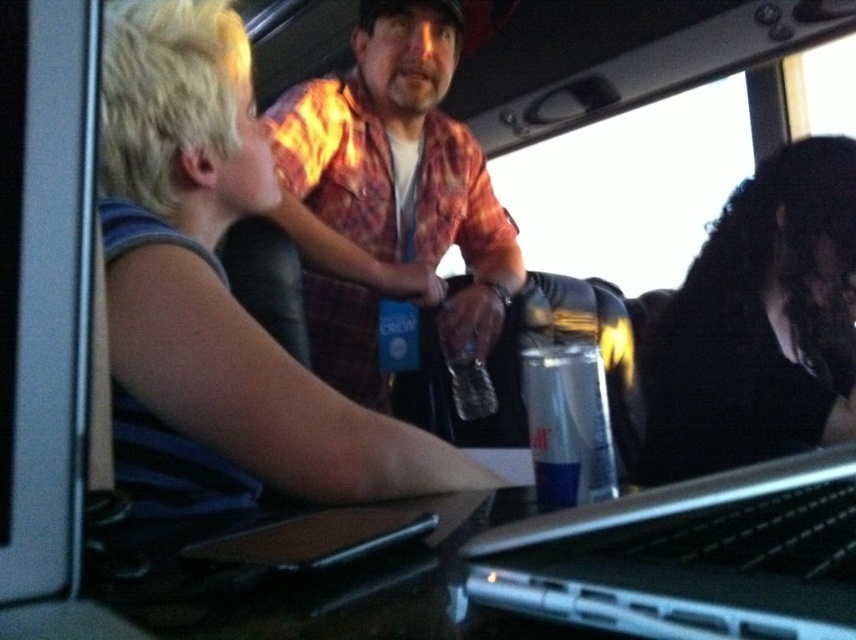
Who is higher up, blonde hair at upper left or clear plastic can at center?

blonde hair at upper left

Does point (280, 432) lie in front of point (563, 376)?

No, (280, 432) is further to viewer.

This screenshot has height=640, width=856. Describe the element at coordinates (217, 296) in the screenshot. I see `blonde hair at upper left` at that location.

The image size is (856, 640). Identify the location of blonde hair at upper left. (217, 296).

Does blonde hair at upper left have a larger size compared to flannel shirt at center?

No.

Does blonde hair at upper left have a greater height compared to flannel shirt at center?

In fact, blonde hair at upper left may be shorter than flannel shirt at center.

Does point (171, 188) lie behind point (381, 96)?

No, it is in front of (381, 96).

Locate an element on the screen. blonde hair at upper left is located at coordinates (217, 296).

Is blonde hair at upper left wider than silver metallic laptop at center?

Indeed, blonde hair at upper left has a greater width compared to silver metallic laptop at center.

Between point (229, 296) and point (795, 522), which one is positioned in front?

Positioned in front is point (795, 522).

Identify the location of blonde hair at upper left. (217, 296).